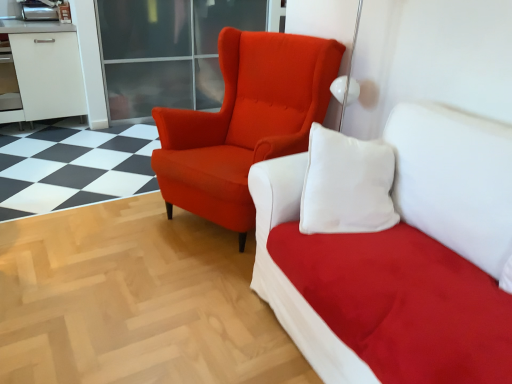
Question: Is matte orange armchair at center smaller than suede white studio couch at upper center?

Choices:
 (A) yes
 (B) no

Answer: (A)

Question: Can suede white studio couch at upper center be found inside matte orange armchair at center?

Choices:
 (A) no
 (B) yes

Answer: (A)

Question: Does matte orange armchair at center have a larger size compared to suede white studio couch at upper center?

Choices:
 (A) no
 (B) yes

Answer: (A)

Question: Can you confirm if matte orange armchair at center is thinner than suede white studio couch at upper center?

Choices:
 (A) yes
 (B) no

Answer: (A)

Question: From the image's perspective, is matte orange armchair at center located beneath suede white studio couch at upper center?

Choices:
 (A) yes
 (B) no

Answer: (B)

Question: Visually, is matte orange armchair at center positioned to the left or to the right of transparent glass door at upper center?

Choices:
 (A) left
 (B) right

Answer: (B)

Question: In the image, is matte orange armchair at center positioned in front of or behind transparent glass door at upper center?

Choices:
 (A) front
 (B) behind

Answer: (A)

Question: From the image's perspective, is matte orange armchair at center positioned above or below transparent glass door at upper center?

Choices:
 (A) above
 (B) below

Answer: (B)

Question: Is matte orange armchair at center spatially inside transparent glass door at upper center, or outside of it?

Choices:
 (A) inside
 (B) outside

Answer: (B)

Question: Is point (225, 0) positioned closer to the camera than point (321, 112)?

Choices:
 (A) farther
 (B) closer

Answer: (A)

Question: From the image's perspective, relative to matte orange armchair at center, is transparent glass door at upper center above or below?

Choices:
 (A) above
 (B) below

Answer: (A)

Question: Considering the positions of transparent glass door at upper center and matte orange armchair at center in the image, is transparent glass door at upper center wider or thinner than matte orange armchair at center?

Choices:
 (A) wide
 (B) thin

Answer: (B)

Question: Considering the positions of transparent glass door at upper center and matte orange armchair at center in the image, is transparent glass door at upper center bigger or smaller than matte orange armchair at center?

Choices:
 (A) small
 (B) big

Answer: (B)

Question: Is suede white studio couch at upper center wider or thinner than matte orange armchair at center?

Choices:
 (A) thin
 (B) wide

Answer: (B)

Question: Would you say suede white studio couch at upper center is to the left or to the right of matte orange armchair at center in the picture?

Choices:
 (A) left
 (B) right

Answer: (B)